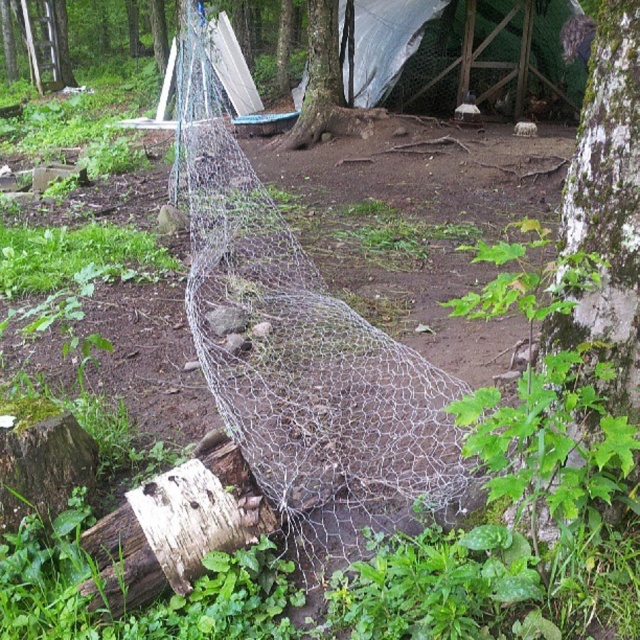
Is wire mesh net at center to the left of white textured bark at center right from the viewer's perspective?

Yes, wire mesh net at center is to the left of white textured bark at center right.

Between point (451, 445) and point (593, 332), which one is positioned behind?

The point (451, 445) is more distant.

Locate an element on the screen. The image size is (640, 640). wire mesh net at center is located at coordinates (301, 355).

Based on the photo, which is above, white textured bark at center right or smooth bark tree at center?

smooth bark tree at center

Is point (618, 112) farther from camera compared to point (332, 54)?

No, it is not.

Find the location of a particular element. The image size is (640, 640). white textured bark at center right is located at coordinates (605, 204).

I want to click on white textured bark at center right, so click(x=605, y=204).

Is point (200, 202) less distant than point (310, 35)?

Yes, it is.

This screenshot has width=640, height=640. What do you see at coordinates (301, 355) in the screenshot?
I see `wire mesh net at center` at bounding box center [301, 355].

In order to click on wire mesh net at center in this screenshot , I will do `click(301, 355)`.